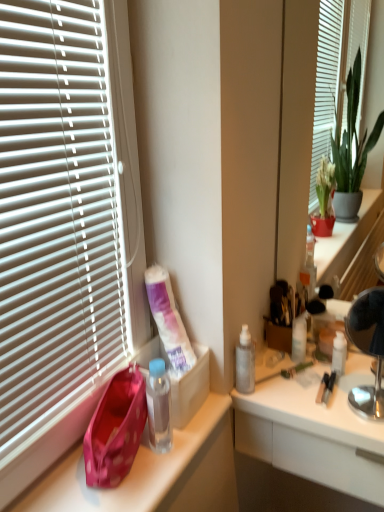
Question: Is transparent plastic bottle at center-right bigger or smaller than metallic silver lamp at right?

Choices:
 (A) small
 (B) big

Answer: (A)

Question: Does point (241, 356) appear closer or farther from the camera than point (377, 323)?

Choices:
 (A) farther
 (B) closer

Answer: (A)

Question: Estimate the real-world distances between objects in this image. Which object is closer to the transparent plastic bottle at center-right?

Choices:
 (A) translucent plastic bottles at center
 (B) metallic silver mirror at right
 (C) white matte tube at lower left
 (D) metallic silver lamp at right
 (E) translucent plastic bottle at upper right

Answer: (C)

Question: Which object is the closest to the translucent plastic bottle at upper right?

Choices:
 (A) pink fabric handbag at left
 (B) metallic silver mirror at right
 (C) transparent plastic bottle at center-right
 (D) metallic silver lamp at right
 (E) translucent plastic bottles at center

Answer: (C)